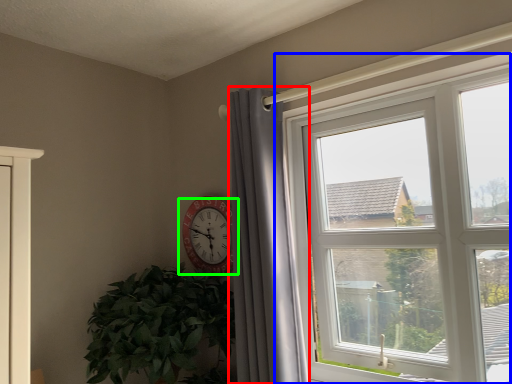
Question: Estimate the real-world distances between objects in this image. Which object is farther from curtain (highlighted by a red box), window (highlighted by a blue box) or wall clock (highlighted by a green box)?

Choices:
 (A) window
 (B) wall clock

Answer: (A)